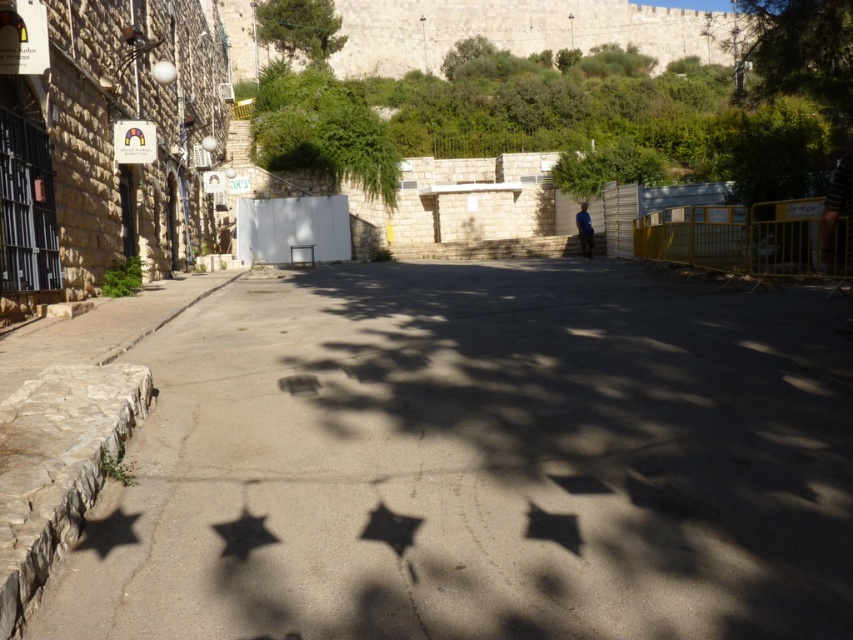
Question: Considering the real-world distances, which object is farthest from the gray concrete pavement at center?

Choices:
 (A) metallic star at lower left
 (B) metallic silver star at center
 (C) black matte star at lower center
 (D) metallic star at center

Answer: (A)

Question: Can you confirm if gray concrete pavement at center is thinner than metallic star at center?

Choices:
 (A) yes
 (B) no

Answer: (B)

Question: Estimate the real-world distances between objects in this image. Which object is closer to the black matte star at lower center?

Choices:
 (A) metallic star at center
 (B) gray concrete pavement at center
 (C) metallic star at lower left

Answer: (C)

Question: Is black matte star at lower center smaller than metallic silver star at center?

Choices:
 (A) no
 (B) yes

Answer: (A)

Question: Does gray concrete pavement at center have a greater width compared to metallic silver star at center?

Choices:
 (A) yes
 (B) no

Answer: (A)

Question: Which object is farther from the camera taking this photo?

Choices:
 (A) black matte star at lower center
 (B) metallic star at center

Answer: (B)